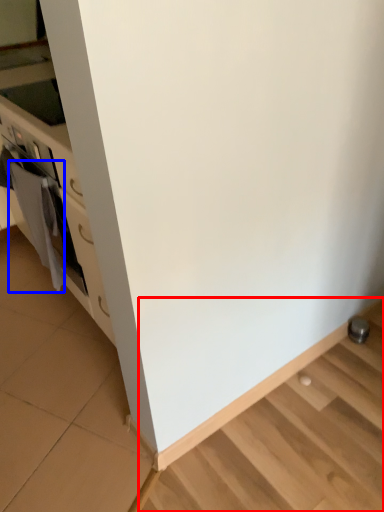
Question: Which point is further to the camera, stairwell (highlighted by a red box) or material (highlighted by a blue box)?

Choices:
 (A) stairwell
 (B) material

Answer: (B)